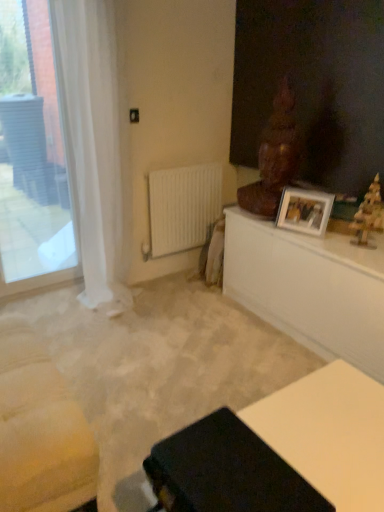
The height and width of the screenshot is (512, 384). Identify the location of vacant region below white matte radiator at center (from a real-world perspective). (175, 274).